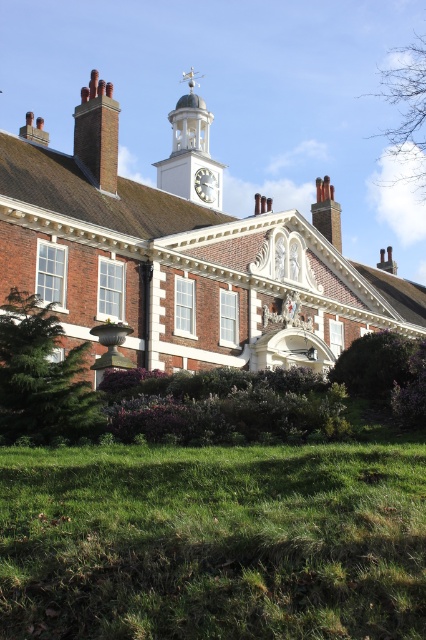
Question: Which object appears closest to the camera in this image?

Choices:
 (A) purple leafy hedge at lower center
 (B) white glossy clock at center
 (C) bare branches at upper right
 (D) brick chimney at upper left

Answer: (A)

Question: Does brick chimney at upper left appear over dark brown brick chimney at upper center?

Choices:
 (A) yes
 (B) no

Answer: (A)

Question: Which object is positioned closest to the green leafy tree at lower left?

Choices:
 (A) white glossy clock at center
 (B) dark brown brick chimney at upper center

Answer: (A)

Question: Which object is farther from the camera taking this photo?

Choices:
 (A) brick chimney at upper left
 (B) dark brown brick chimney at upper center

Answer: (B)

Question: Does bare branches at upper right have a larger size compared to white glossy clock at center?

Choices:
 (A) no
 (B) yes

Answer: (B)

Question: Does brick chimney at upper left have a lesser width compared to white glossy clock at center?

Choices:
 (A) no
 (B) yes

Answer: (A)